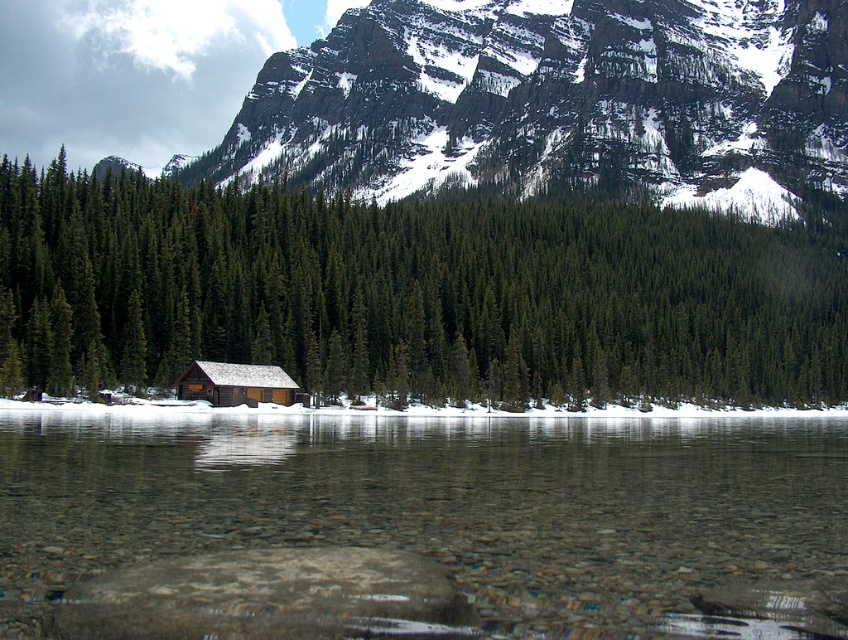
Is green matte tree at center shorter than clear glass water at center?

No, green matte tree at center is not shorter than clear glass water at center.

Between point (717, 250) and point (505, 440), which one is positioned in front?

Point (505, 440)

You are a GUI agent. You are given a task and a screenshot of the screen. Output one action in this format:
    pyautogui.click(x=<x>, y=<y>)
    Task: Click on the green matte tree at center
    Image resolution: width=848 pixels, height=640 pixels.
    Given the screenshot: What is the action you would take?
    pyautogui.click(x=413, y=292)

Does green matte tree at center have a lesser height compared to wooden cabin at center?

Incorrect, green matte tree at center's height does not fall short of wooden cabin at center's.

Where is `green matte tree at center`? The image size is (848, 640). green matte tree at center is located at coordinates (413, 292).

Who is taller, clear glass water at center or wooden cabin at center?

wooden cabin at center

Does clear glass water at center have a greater height compared to wooden cabin at center?

No, clear glass water at center is not taller than wooden cabin at center.

Is point (824, 449) closer to camera compared to point (280, 388)?

Yes, point (824, 449) is in front of point (280, 388).

Image resolution: width=848 pixels, height=640 pixels. Identify the location of clear glass water at center. [x=434, y=502].